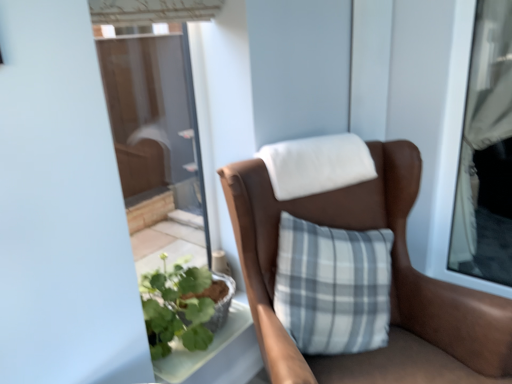
Question: Is matte white curtain at right far away from brown leather chair at center?

Choices:
 (A) no
 (B) yes

Answer: (B)

Question: Can you confirm if matte white curtain at right is bigger than brown leather chair at center?

Choices:
 (A) yes
 (B) no

Answer: (B)

Question: Is the position of matte white curtain at right more distant than that of brown leather chair at center?

Choices:
 (A) no
 (B) yes

Answer: (B)

Question: Is brown leather chair at center at the back of matte white curtain at right?

Choices:
 (A) yes
 (B) no

Answer: (B)

Question: Is brown leather chair at center located within matte white curtain at right?

Choices:
 (A) no
 (B) yes

Answer: (A)

Question: From the image's perspective, is matte white curtain at right below brown leather chair at center?

Choices:
 (A) yes
 (B) no

Answer: (B)

Question: From the image's perspective, would you say brown leather chair at center is shown under matte white curtain at right?

Choices:
 (A) no
 (B) yes

Answer: (B)

Question: Considering the relative positions of brown leather chair at center and matte white curtain at right in the image provided, is brown leather chair at center to the right of matte white curtain at right from the viewer's perspective?

Choices:
 (A) no
 (B) yes

Answer: (A)

Question: Can you confirm if brown leather chair at center is positioned to the left of matte white curtain at right?

Choices:
 (A) no
 (B) yes

Answer: (B)

Question: From a real-world perspective, is brown leather chair at center on top of matte white curtain at right?

Choices:
 (A) yes
 (B) no

Answer: (B)

Question: From a real-world perspective, does brown leather chair at center sit lower than matte white curtain at right?

Choices:
 (A) no
 (B) yes

Answer: (B)

Question: Is brown leather chair at center further to the viewer compared to matte white curtain at right?

Choices:
 (A) no
 (B) yes

Answer: (A)

Question: In the image, is matte white curtain at right on the left side or the right side of brown leather chair at center?

Choices:
 (A) left
 (B) right

Answer: (B)